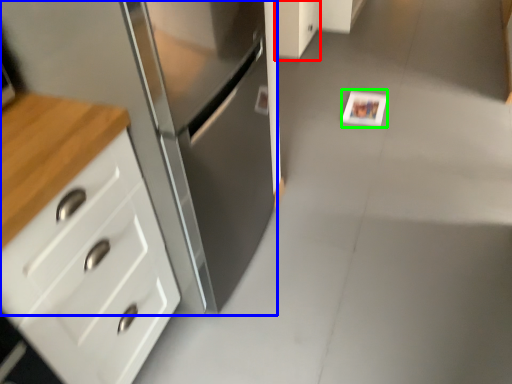
Question: Which object is positioned closest to cabinetry (highlighted by a red box)? Select from cabinetry (highlighted by a blue box) and postcard (highlighted by a green box).

Choices:
 (A) cabinetry
 (B) postcard

Answer: (B)